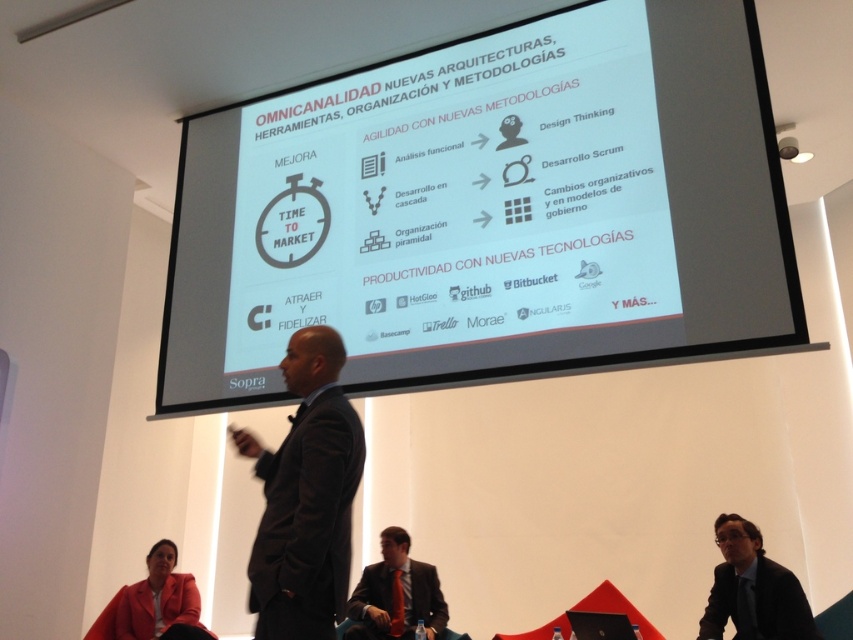
Is dark suit at center to the left of matte red blazer at lower left from the viewer's perspective?

Incorrect, dark suit at center is not on the left side of matte red blazer at lower left.

How much distance is there between dark suit at center and matte red blazer at lower left?

dark suit at center is 2.10 meters away from matte red blazer at lower left.

Find the location of a particular element. The image size is (853, 640). dark suit at center is located at coordinates (305, 497).

I want to click on dark suit at center, so click(305, 497).

In the scene shown: Does white matte projection screen at center have a smaller size compared to black fabric business suit at lower right?

No.

Does white matte projection screen at center appear over black fabric business suit at lower right?

Yes.

Where is `white matte projection screen at center`? white matte projection screen at center is located at coordinates (489, 211).

Locate an element on the screen. white matte projection screen at center is located at coordinates (489, 211).

Does white matte projection screen at center appear on the left side of matte black suit at lower center?

In fact, white matte projection screen at center is to the right of matte black suit at lower center.

Locate an element on the screen. The width and height of the screenshot is (853, 640). white matte projection screen at center is located at coordinates (489, 211).